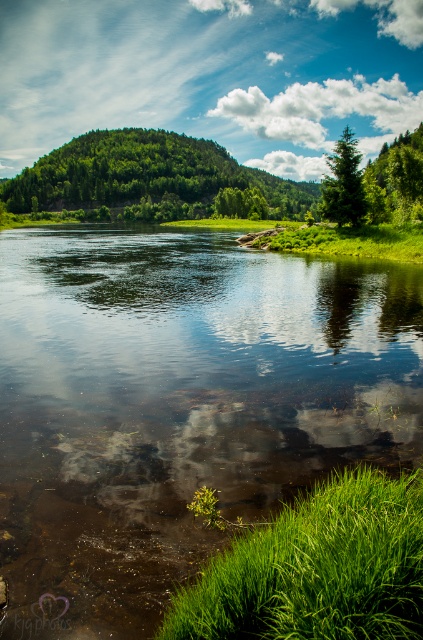
Does point (332, 444) lie behind point (381, 200)?

No, (332, 444) is in front of (381, 200).

Consider the image. Is clear water at center to the left of green leafy tree at upper right from the viewer's perspective?

Yes, clear water at center is to the left of green leafy tree at upper right.

Identify the location of clear water at center. (178, 404).

Where is `clear water at center`? clear water at center is located at coordinates (178, 404).

Can you confirm if clear water at center is shorter than green leafy tree at upper left?

Correct, clear water at center is not as tall as green leafy tree at upper left.

Which is above, clear water at center or green leafy tree at upper left?

green leafy tree at upper left

Is point (362, 401) positioned after point (52, 184)?

No, it is in front of (52, 184).

Where is `clear water at center`? This screenshot has width=423, height=640. clear water at center is located at coordinates (178, 404).

Does point (208, 296) come closer to viewer compared to point (227, 561)?

That is False.

Is clear water at center shorter than green grass at lower right?

No, clear water at center is not shorter than green grass at lower right.

Is point (393, 358) more distant than point (233, 566)?

Yes, it is behind point (233, 566).

Locate an element on the screen. This screenshot has height=640, width=423. clear water at center is located at coordinates (178, 404).